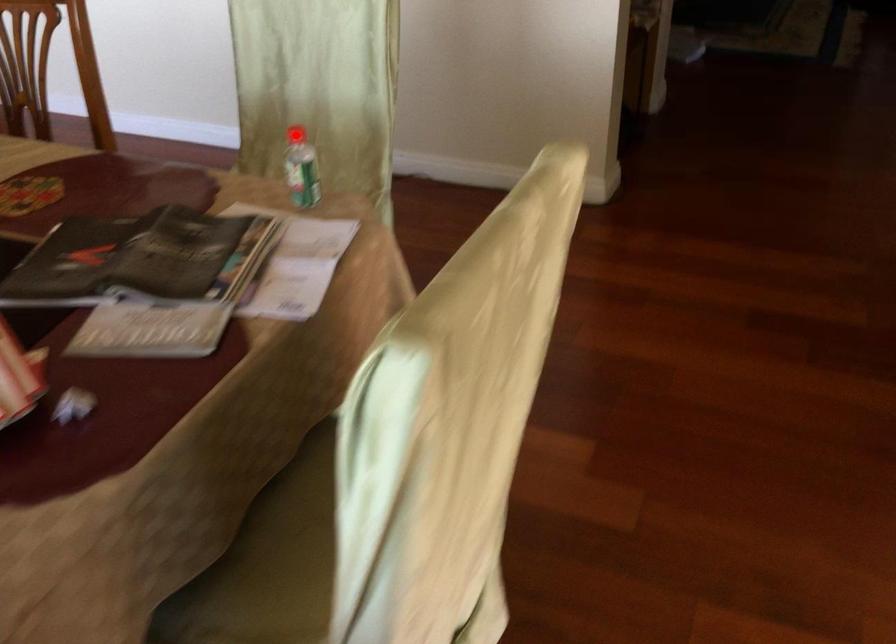
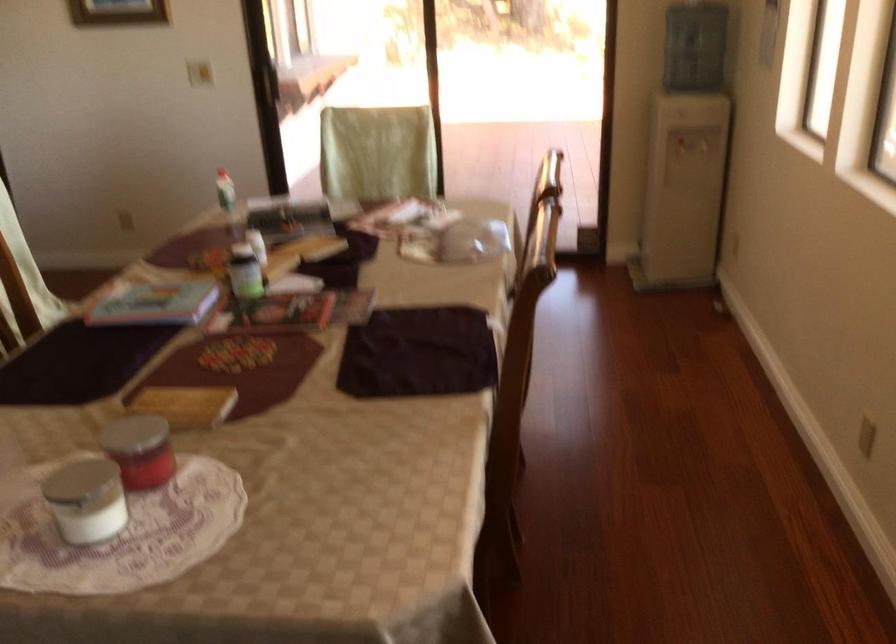
Question: I am providing you with two images of the same scene from different viewpoints. A red point is marked on the first image. At the location where the point appears in image 1, is it still visible in image 2?

Choices:
 (A) Yes
 (B) No

Answer: (B)